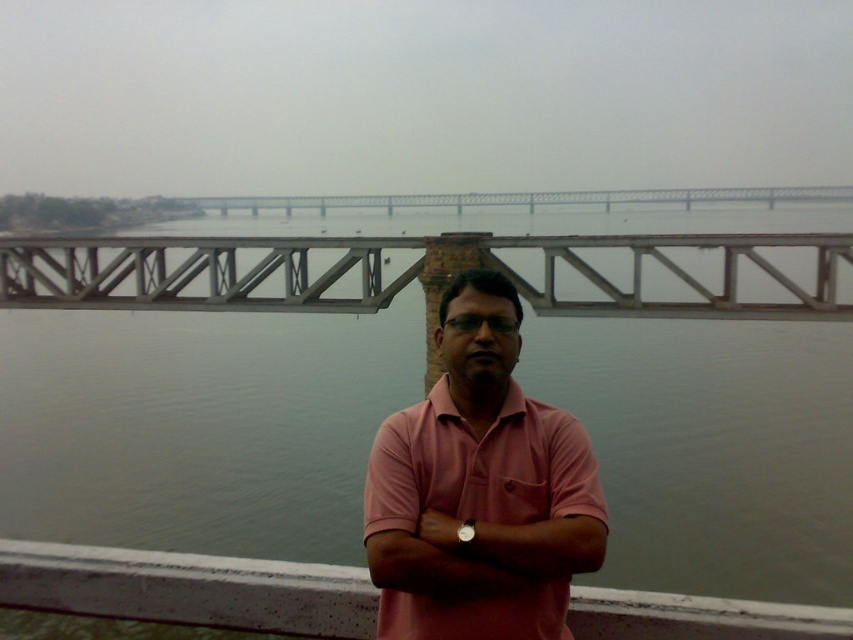
You are a photographer trying to capture the bridge in the image. You notice two points marked on the bridge structure. The first point is at coordinates point (556, 436) and the second is at point (842, 244). Which point would appear larger in your photo?

Point (556, 436) is closer to the viewer than point (842, 244), so it would appear larger in the photo.

You are a photographer trying to capture the man in the pink cotton shirt at center and the metallic gray bridge at upper center in a single frame. Based on their sizes in the image, which object will appear smaller in the photo?

The pink cotton shirt at center will appear smaller in the photo because it occupies less space than the metallic gray bridge at upper center.

You are standing at the point marked as point (x=517, y=344) in the image. The man in the pink polo shirt is standing 3.53 meters away from you. If you want to take a photo of him, should you use a wide angle lens or a telephoto lens?

Since the man in the pink polo shirt is 3.53 meters away from you, you should use a telephoto lens to capture him clearly from that distance.